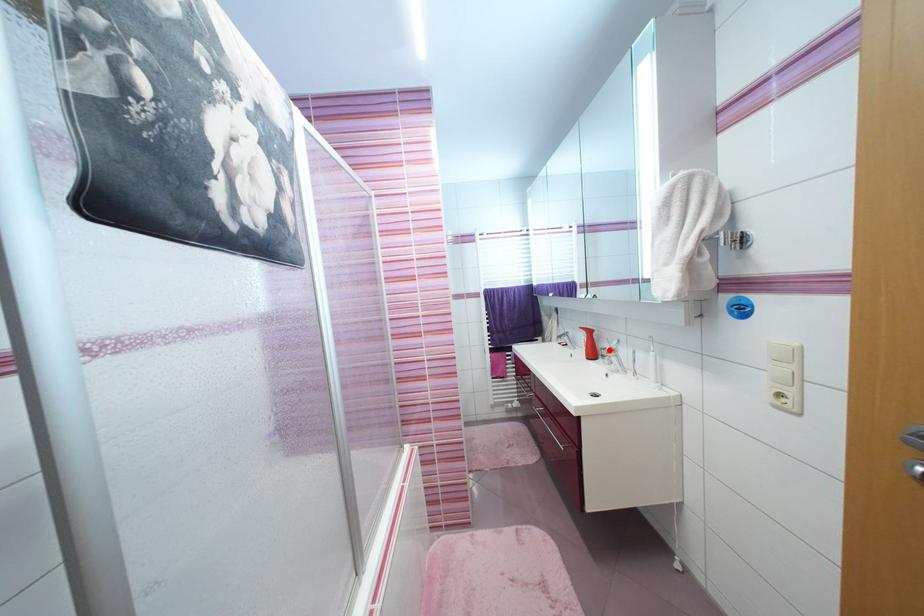
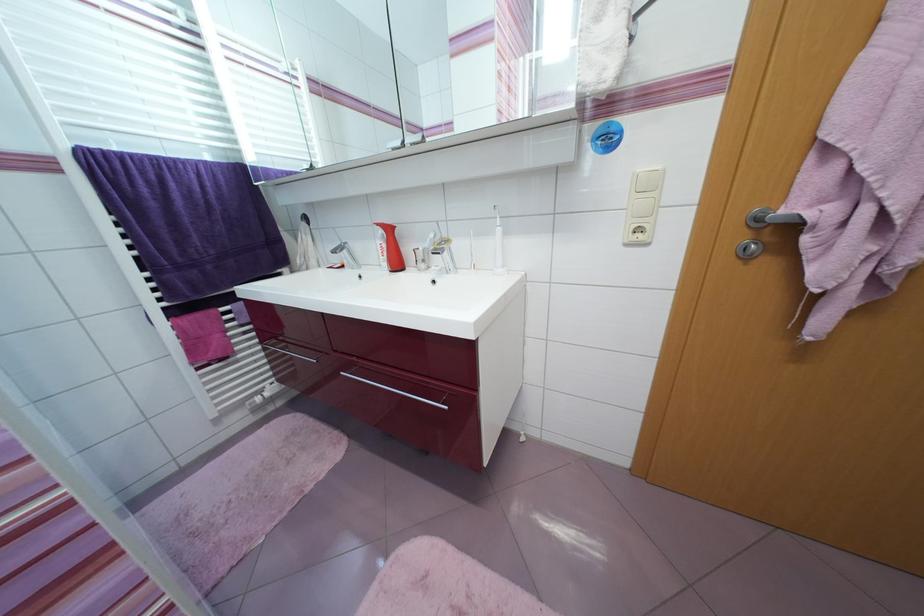
Locate, in the second image, the point that corresponds to the highlighted location in the first image.

(423, 251)